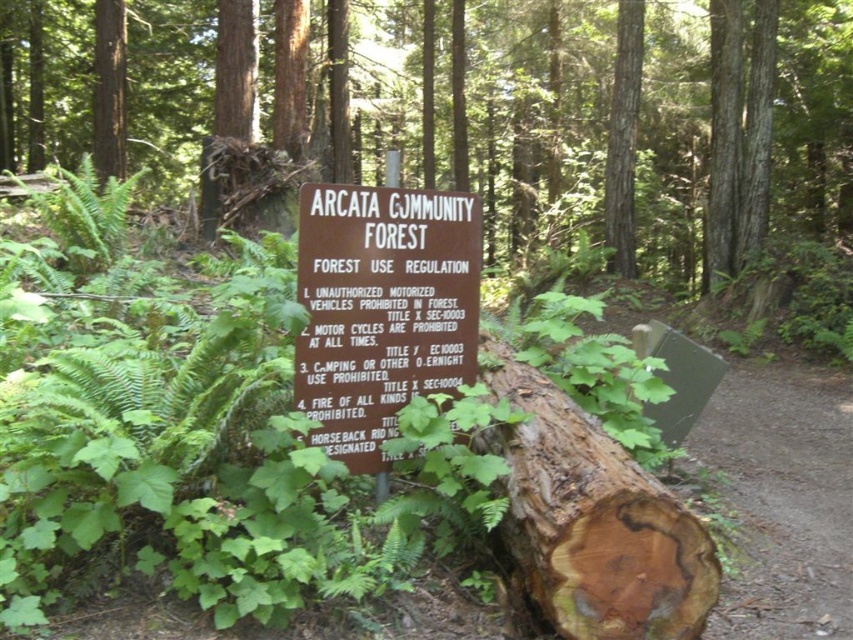
Question: Which object is positioned farthest from the brown wooden sign at center?

Choices:
 (A) brown rough bark log at center
 (B) rough bark log at center

Answer: (B)

Question: Can you confirm if rough bark log at center is positioned to the left of brown wooden sign at center?

Choices:
 (A) yes
 (B) no

Answer: (A)

Question: Estimate the real-world distances between objects in this image. Which object is closer to the brown wooden sign at center?

Choices:
 (A) rough bark log at center
 (B) brown rough bark log at center

Answer: (B)

Question: Does rough bark log at center appear on the right side of brown rough bark log at center?

Choices:
 (A) no
 (B) yes

Answer: (A)

Question: Which of these objects is positioned closest to the brown rough bark log at center?

Choices:
 (A) rough bark log at center
 (B) brown wooden sign at center

Answer: (B)

Question: Can you confirm if brown wooden sign at center is positioned to the left of brown rough bark log at center?

Choices:
 (A) yes
 (B) no

Answer: (A)